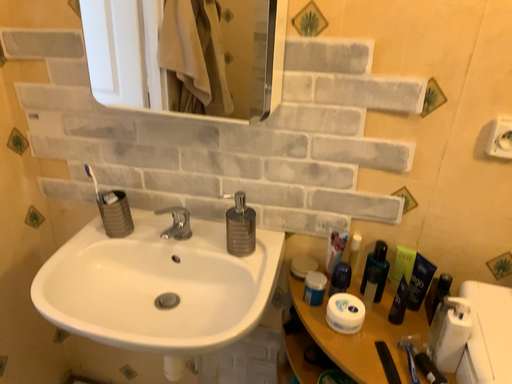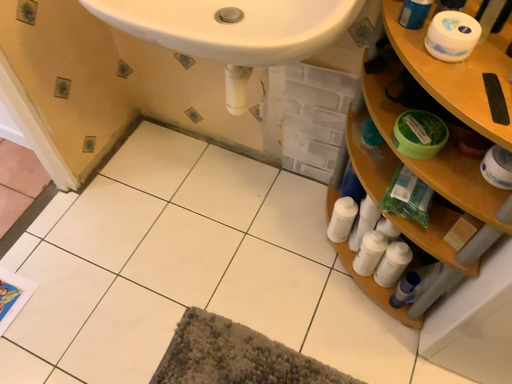
Question: Which way did the camera rotate in the video?

Choices:
 (A) rotated left
 (B) rotated right

Answer: (A)